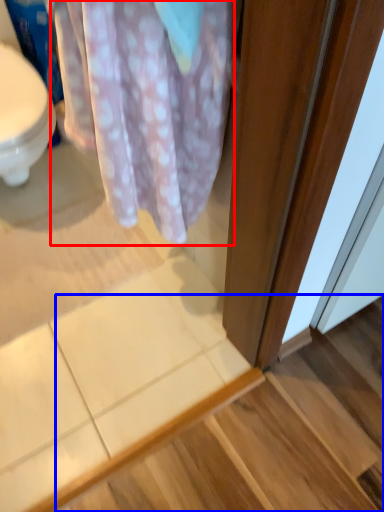
Question: Which object appears farthest to the camera in this image, blanket (highlighted by a red box) or stair (highlighted by a blue box)?

Choices:
 (A) blanket
 (B) stair

Answer: (B)